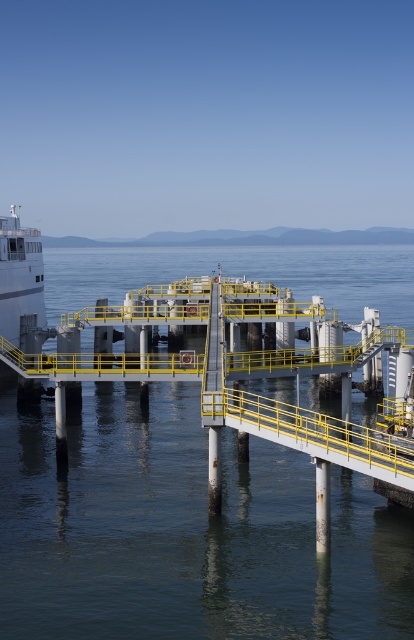
You are standing on the dock and looking at the clear blue water at center and the white glossy ship at left. Which object is higher in the image?

The clear blue water at center is much taller than the white glossy ship at left in the image.

You are a photographer planning to capture the waterfront scene. You want to ensure that the clear blue water at center and the white glossy ship at left are both visible in your shot. Which object should you position closer to the edge of the frame to include both?

The white glossy ship at left should be positioned closer to the edge of the frame since the clear blue water at center is wider than the white glossy ship at left, allowing more space for the ship to fit near the edge while still capturing both objects.